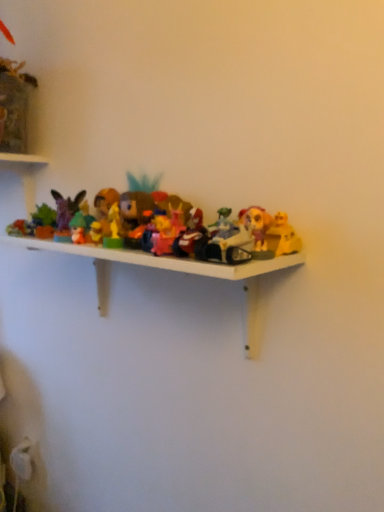
Question: Considering the positions of matte purple figurine at left, which ranks as the seventh toy in right-to-left order, and matte plastic toy at center, the third toy positioned from the right, in the image, is matte purple figurine at left, which ranks as the seventh toy in right-to-left order, wider or thinner than matte plastic toy at center, the third toy positioned from the right,?

Choices:
 (A) wide
 (B) thin

Answer: (B)

Question: From the image's perspective, is matte purple figurine at left, which ranks as the seventh toy in right-to-left order, located above or below matte plastic toy at center, acting as the fifth toy starting from the left?

Choices:
 (A) above
 (B) below

Answer: (A)

Question: Which of these objects is positioned farthest from the yellow plastic toy at right, which is counted as the first toy, starting from the right?

Choices:
 (A) green matte figurine at center, positioned as the sixth toy in right-to-left order
 (B) pink plastic toy at center, the fourth toy from the left
 (C) matte plastic toy at center, acting as the fifth toy starting from the left
 (D) matte purple figurine at left, the 1th toy positioned from the left
 (E) matte plastic toy at center, the 5th toy viewed from the right

Answer: (D)

Question: Estimate the real-world distances between objects in this image. Which object is closer to the matte plastic toy at center, which is the third toy from left to right?

Choices:
 (A) matte purple figurine at left, which ranks as the seventh toy in right-to-left order
 (B) yellow plastic toy at right, the seventh toy when ordered from left to right
 (C) pink plastic toy at center, which appears as the fourth toy when viewed from the right
 (D) green matte figurine at center, positioned as the sixth toy in right-to-left order
 (E) matte plastic toy at center, the third toy positioned from the right

Answer: (C)